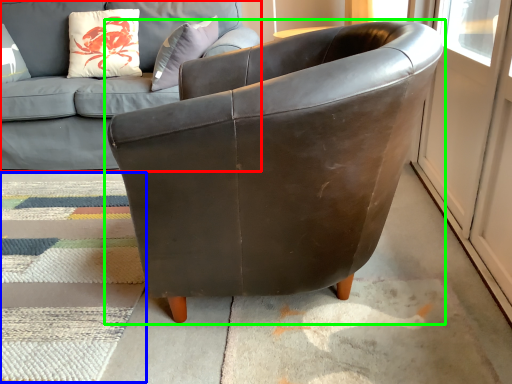
Question: Which object is the closest to the studio couch (highlighted by a red box)? Choose among these: mat (highlighted by a blue box) or chair (highlighted by a green box).

Choices:
 (A) mat
 (B) chair

Answer: (A)